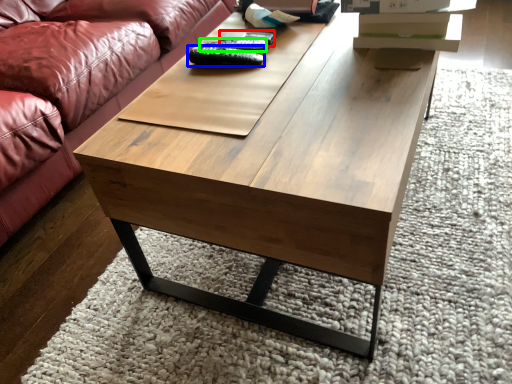
Question: Considering the real-world distances, which object is closest to remote (highlighted by a red box)? remote (highlighted by a blue box) or remote (highlighted by a green box).

Choices:
 (A) remote
 (B) remote

Answer: (B)